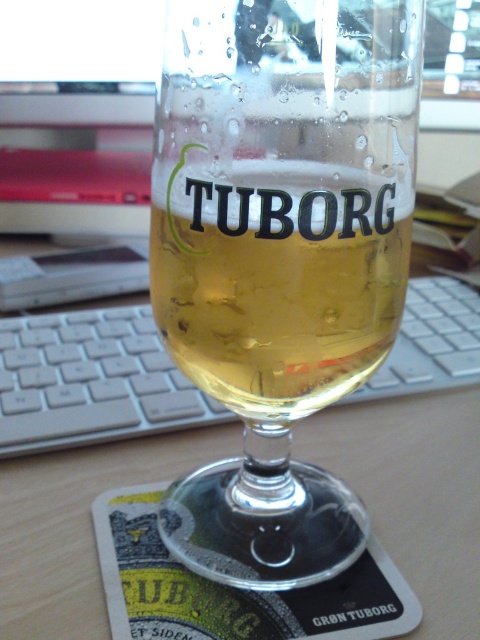
Which is in front, point (283, 179) or point (46, 561)?

Point (283, 179) is in front.

Who is positioned more to the left, translucent glass beer at center or wooden table at center?

translucent glass beer at center

Image resolution: width=480 pixels, height=640 pixels. In order to click on translucent glass beer at center in this screenshot , I will do `click(276, 276)`.

Find the location of a particular element. The width and height of the screenshot is (480, 640). translucent glass beer at center is located at coordinates pos(276,276).

Can you confirm if translucent glass beer glass at center is positioned above translucent glass beer at center?

No.

Image resolution: width=480 pixels, height=640 pixels. I want to click on translucent glass beer glass at center, so click(x=279, y=257).

Where is `translucent glass beer glass at center`? translucent glass beer glass at center is located at coordinates (279, 257).

Between point (333, 557) and point (444, 561), which one is positioned in front?

Point (333, 557) is in front.

Is translucent glass beer glass at center closer to the viewer compared to wooden table at center?

Yes.

Between point (207, 476) and point (16, 584), which one is positioned behind?

Point (207, 476)

Locate an element on the screen. The height and width of the screenshot is (640, 480). translucent glass beer glass at center is located at coordinates (279, 257).